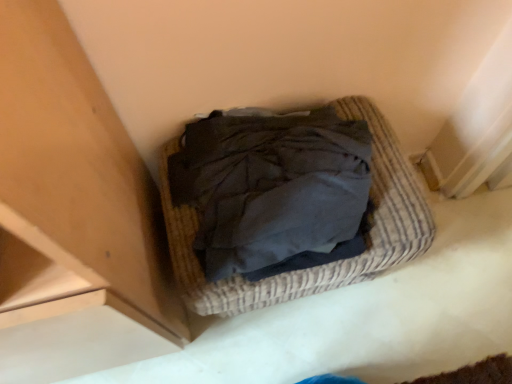
What do you see at coordinates (322, 265) in the screenshot? I see `woven fabric basket at center` at bounding box center [322, 265].

Locate an element on the screen. The width and height of the screenshot is (512, 384). woven fabric basket at center is located at coordinates (322, 265).

Image resolution: width=512 pixels, height=384 pixels. In order to click on woven fabric basket at center in this screenshot , I will do `click(322, 265)`.